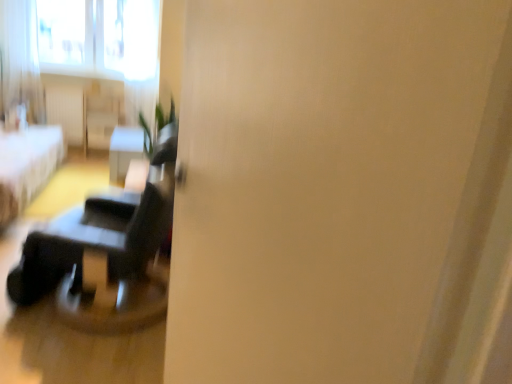
Describe the element at coordinates (27, 166) in the screenshot. I see `white fabric bed at left` at that location.

Measure the distance between point (116, 161) and camera.

A distance of 4.34 meters exists between point (116, 161) and camera.

Where is `white fabric bed at left`? The height and width of the screenshot is (384, 512). white fabric bed at left is located at coordinates (27, 166).

Is point (23, 189) less distant than point (118, 166)?

Yes.

Measure the distance from white fabric bed at left to matte black table at center.

They are 30.41 inches apart.

Is white fabric bed at left next to matte black table at center and touching it?

No.

Can you confirm if white fabric bed at left is shorter than matte black table at center?

In fact, white fabric bed at left may be taller than matte black table at center.

Who is taller, white fabric bed at left or white sheer curtain at upper left?

Standing taller between the two is white sheer curtain at upper left.

From the image's perspective, is white fabric bed at left located above white sheer curtain at upper left?

No, from the image's perspective, white fabric bed at left is not on top of white sheer curtain at upper left.

Between white fabric bed at left and white sheer curtain at upper left, which one appears on the left side from the viewer's perspective?

white sheer curtain at upper left is more to the left.

Is the surface of white fabric bed at left in direct contact with white sheer curtain at upper left?

No, white fabric bed at left is not making contact with white sheer curtain at upper left.

From the image's perspective, is white sheer curtain at upper left located above matte black table at center?

Yes, from the image's perspective, white sheer curtain at upper left is on top of matte black table at center.

In the scene shown: Is the surface of white sheer curtain at upper left in direct contact with matte black table at center?

white sheer curtain at upper left and matte black table at center are not in contact.

Identify the location of curtain above the matte black table at center (from the image's perspective). This screenshot has height=384, width=512. click(20, 59).

Are white sheer curtain at upper left and white fabric bed at left located far from each other?

white sheer curtain at upper left is far away from white fabric bed at left.

From the image's perspective, is white sheer curtain at upper left located beneath white fabric bed at left?

Actually, white sheer curtain at upper left appears above white fabric bed at left in the image.

You are a GUI agent. You are given a task and a screenshot of the screen. Output one action in this format:
    pyautogui.click(x=<x>, y=<y>)
    Task: Click on the furniture below the white sheer curtain at upper left (from a real-world perspective)
    
    Given the screenshot: What is the action you would take?
    pyautogui.click(x=27, y=166)

Can you confirm if matte black table at center is positioned to the right of white fabric bed at left?

Yes.

Find the location of a particular element. The image size is (512, 384). table behind the white fabric bed at left is located at coordinates (124, 152).

From a real-world perspective, which object rests below the other?

In real-world perspective, matte black table at center is lower.

Is point (120, 172) in front of point (18, 167)?

That is False.

Is matte black table at center facing towards white sheer curtain at upper left?

No, matte black table at center is not oriented towards white sheer curtain at upper left.

From a real-world perspective, is matte black table at center under white sheer curtain at upper left?

Yes.

Which object is further away from the camera, matte black table at center or white sheer curtain at upper left?

white sheer curtain at upper left is further away from the camera.

Locate an element on the screen. The width and height of the screenshot is (512, 384). furniture above the matte black table at center (from the image's perspective) is located at coordinates (27, 166).

The height and width of the screenshot is (384, 512). Identify the location of furniture in front of the white sheer curtain at upper left. (27, 166).

From the image, which object appears to be nearer to white fabric bed at left, matte black table at center or white sheer curtain at upper left?

matte black table at center lies closer to white fabric bed at left than the other object.

When comparing their distances from white sheer curtain at upper left, does white fabric bed at left or matte black table at center seem closer?

white fabric bed at left lies closer to white sheer curtain at upper left than the other object.

Estimate the real-world distances between objects in this image. Which object is further from white fabric bed at left, white sheer curtain at upper left or matte black table at center?

The object further to white fabric bed at left is white sheer curtain at upper left.

Considering their positions, is white fabric bed at left positioned further to matte black table at center than white sheer curtain at upper left?

Among the two, white sheer curtain at upper left is located further to matte black table at center.

Based on their spatial positions, is matte black table at center or white fabric bed at left closer to white sheer curtain at upper left?

Based on the image, white fabric bed at left appears to be nearer to white sheer curtain at upper left.

Estimate the real-world distances between objects in this image. Which object is closer to matte black table at center, white sheer curtain at upper left or white fabric bed at left?

white fabric bed at left lies closer to matte black table at center than the other object.

The image size is (512, 384). Identify the location of table between white fabric bed at left and white sheer curtain at upper left along the z-axis. (124, 152).